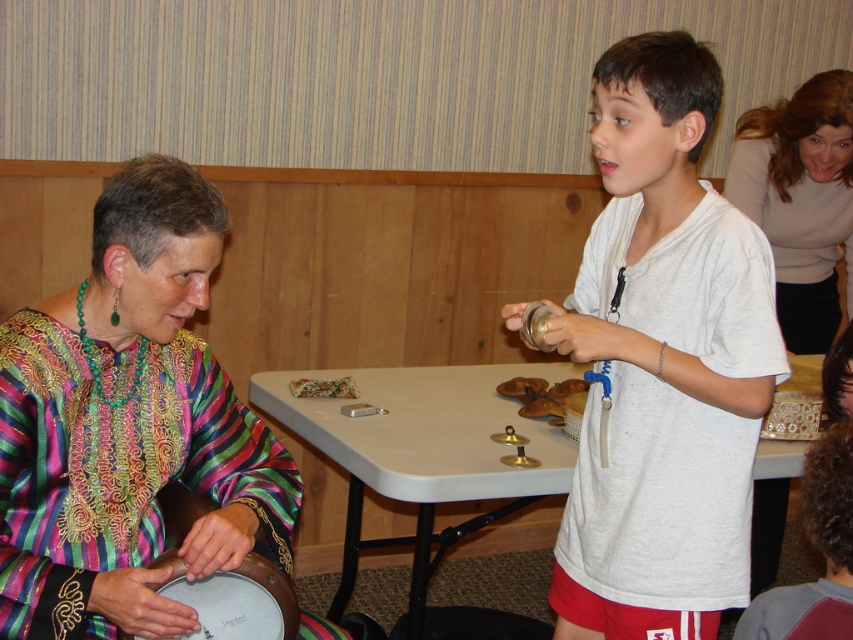
Who is positioned more to the right, white plastic table at center or matte beige sweater at upper right?

Positioned to the right is matte beige sweater at upper right.

Can you confirm if white plastic table at center is positioned to the left of matte beige sweater at upper right?

Indeed, white plastic table at center is positioned on the left side of matte beige sweater at upper right.

Find the location of a particular element. Image resolution: width=853 pixels, height=640 pixels. white plastic table at center is located at coordinates (421, 449).

Where is `white plastic table at center`? The image size is (853, 640). white plastic table at center is located at coordinates 421,449.

Can you confirm if white cotton shirt at center is shorter than white plastic table at center?

No.

Locate an element on the screen. white cotton shirt at center is located at coordinates (662, 362).

Between matte beige sweater at upper right and wooden drum at lower left, which one is positioned lower?

Positioned lower is wooden drum at lower left.

Is point (813, 259) positioned behind point (271, 572)?

Yes, it is.

Describe the element at coordinates (799, 200) in the screenshot. Image resolution: width=853 pixels, height=640 pixels. I see `matte beige sweater at upper right` at that location.

Image resolution: width=853 pixels, height=640 pixels. What are the coordinates of `matte beige sweater at upper right` in the screenshot? It's located at (x=799, y=200).